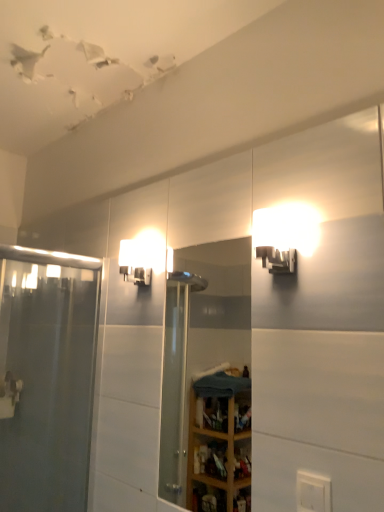
Find the location of a particular element. Image resolution: width=384 pixels, height=512 pixels. matte white sconce at upper center, which is the 1th light fixture from back to front is located at coordinates [134, 263].

Identify the location of matte white sconce at upper right, the 1th light fixture from the front. Image resolution: width=384 pixels, height=512 pixels. (284, 236).

Is point (131, 259) farther from camera compared to point (14, 432)?

That is True.

Is the surface of matte white sconce at upper center, which is the 2th light fixture in right-to-left order, in direct contact with clear glass shower door at left?

There is a gap between matte white sconce at upper center, which is the 2th light fixture in right-to-left order, and clear glass shower door at left.

Which object is closer to the camera, matte white sconce at upper center, which is the 2th light fixture in right-to-left order, or clear glass shower door at left?

clear glass shower door at left is closer to the camera.

Is matte white sconce at upper center, which is the 2th light fixture in right-to-left order, bigger or smaller than clear glass shower door at left?

Considering their sizes, matte white sconce at upper center, which is the 2th light fixture in right-to-left order, takes up less space than clear glass shower door at left.

Which object is further away from the camera, matte white sconce at upper center, which is the 2th light fixture in right-to-left order, or matte white sconce at upper right, placed as the 2th light fixture when sorted from left to right?

matte white sconce at upper center, which is the 2th light fixture in right-to-left order.

Does matte white sconce at upper center, which ranks as the first light fixture in left-to-right order, appear on the left side of matte white sconce at upper right, marked as the 2th light fixture in a back-to-front arrangement?

Indeed, matte white sconce at upper center, which ranks as the first light fixture in left-to-right order, is positioned on the left side of matte white sconce at upper right, marked as the 2th light fixture in a back-to-front arrangement.

Which is nearer, (135, 283) or (294, 218)?

Point (135, 283) appears to be farther away from the viewer than point (294, 218).

Is matte white sconce at upper center, acting as the second light fixture starting from the front, completely or partially outside of matte white sconce at upper right, marked as the 2th light fixture in a back-to-front arrangement?

That's correct, matte white sconce at upper center, acting as the second light fixture starting from the front, is outside of matte white sconce at upper right, marked as the 2th light fixture in a back-to-front arrangement.

Is clear glass mirror at center facing towards clear glass shower door at left?

No, clear glass mirror at center is not turned towards clear glass shower door at left.

From the image's perspective, which one is positioned lower, clear glass mirror at center or clear glass shower door at left?

clear glass shower door at left is shown below in the image.

Is point (216, 317) behind point (59, 483)?

Yes, it is behind point (59, 483).

Can you confirm if matte white sconce at upper right, the 1th light fixture from the front, is taller than white plastic electric outlet at lower right?

No.

Is matte white sconce at upper right, the 1th light fixture from the front, inside or outside of white plastic electric outlet at lower right?

matte white sconce at upper right, the 1th light fixture from the front, is not inside white plastic electric outlet at lower right, it's outside.

Can you tell me how much matte white sconce at upper right, placed as the 2th light fixture when sorted from left to right, and white plastic electric outlet at lower right differ in facing direction?

0.375 degrees.

At what (x,y) coordinates should I click in order to perform the action: click on mirror on the right of matte white sconce at upper center, acting as the second light fixture starting from the front. Please return your answer as a coordinate pair (x, y). The width and height of the screenshot is (384, 512). Looking at the image, I should click on (206, 372).

From the picture: Who is smaller, matte white sconce at upper center, which is the 2th light fixture in right-to-left order, or clear glass mirror at center?

matte white sconce at upper center, which is the 2th light fixture in right-to-left order.

Looking at this image, does matte white sconce at upper center, which is the 2th light fixture in right-to-left order, have a greater height compared to clear glass mirror at center?

No.

From a real-world perspective, is matte white sconce at upper center, which ranks as the first light fixture in left-to-right order, positioned over clear glass mirror at center based on gravity?

Yes, from a real-world perspective, matte white sconce at upper center, which ranks as the first light fixture in left-to-right order, is above clear glass mirror at center.

From the picture: Who is more distant, clear glass mirror at center or white plastic electric outlet at lower right?

Positioned behind is clear glass mirror at center.

How different are the orientations of clear glass mirror at center and white plastic electric outlet at lower right in degrees?

0.668 degrees separate the facing orientations of clear glass mirror at center and white plastic electric outlet at lower right.

Could you tell me if clear glass mirror at center is turned towards white plastic electric outlet at lower right?

No, clear glass mirror at center is not oriented towards white plastic electric outlet at lower right.

From a real-world perspective, which is physically below, white plastic electric outlet at lower right or matte white sconce at upper center, which is the 1th light fixture from back to front?

From a 3D spatial view, white plastic electric outlet at lower right is below.

Is white plastic electric outlet at lower right wider than matte white sconce at upper center, which is the 2th light fixture in right-to-left order?

No.

From the image's perspective, does white plastic electric outlet at lower right appear lower than matte white sconce at upper center, acting as the second light fixture starting from the front?

Correct, white plastic electric outlet at lower right appears lower than matte white sconce at upper center, acting as the second light fixture starting from the front, in the image.

This screenshot has width=384, height=512. What are the coordinates of `screen door lying on the left of matte white sconce at upper center, which ranks as the first light fixture in left-to-right order` in the screenshot? It's located at (46, 377).

I want to click on light fixture located underneath the matte white sconce at upper right, the first light fixture in the right-to-left sequence (from a real-world perspective), so click(x=134, y=263).

Based on their spatial positions, is matte white sconce at upper center, which is the 2th light fixture in right-to-left order, or white plastic electric outlet at lower right closer to clear glass shower door at left?

Based on the image, matte white sconce at upper center, which is the 2th light fixture in right-to-left order, appears to be nearer to clear glass shower door at left.

Estimate the real-world distances between objects in this image. Which object is further from white plastic electric outlet at lower right, clear glass mirror at center or matte white sconce at upper center, which is the 1th light fixture from back to front?

clear glass mirror at center is further to white plastic electric outlet at lower right.

Considering their positions, is matte white sconce at upper right, marked as the 2th light fixture in a back-to-front arrangement, positioned further to clear glass shower door at left than matte white sconce at upper center, acting as the second light fixture starting from the front?

The object further to clear glass shower door at left is matte white sconce at upper right, marked as the 2th light fixture in a back-to-front arrangement.

Considering their positions, is matte white sconce at upper right, the 1th light fixture from the front, positioned closer to matte white sconce at upper center, which ranks as the first light fixture in left-to-right order, than white plastic electric outlet at lower right?

matte white sconce at upper right, the 1th light fixture from the front, lies closer to matte white sconce at upper center, which ranks as the first light fixture in left-to-right order, than the other object.

From the image, which object appears to be nearer to white plastic electric outlet at lower right, clear glass mirror at center or matte white sconce at upper right, placed as the 2th light fixture when sorted from left to right?

matte white sconce at upper right, placed as the 2th light fixture when sorted from left to right.

Looking at the image, which one is located further to matte white sconce at upper center, which ranks as the first light fixture in left-to-right order, white plastic electric outlet at lower right or clear glass shower door at left?

white plastic electric outlet at lower right is positioned further to the anchor matte white sconce at upper center, which ranks as the first light fixture in left-to-right order.

Based on their spatial positions, is clear glass shower door at left or matte white sconce at upper center, which is the 1th light fixture from back to front, closer to white plastic electric outlet at lower right?

The object closer to white plastic electric outlet at lower right is matte white sconce at upper center, which is the 1th light fixture from back to front.

Considering their positions, is clear glass shower door at left positioned further to matte white sconce at upper center, which ranks as the first light fixture in left-to-right order, than matte white sconce at upper right, the first light fixture in the right-to-left sequence?

clear glass shower door at left is positioned further to the anchor matte white sconce at upper center, which ranks as the first light fixture in left-to-right order.

The height and width of the screenshot is (512, 384). Identify the location of light fixture between clear glass shower door at left and clear glass mirror at center in the horizontal direction. (134, 263).

Identify the location of mirror located between clear glass shower door at left and white plastic electric outlet at lower right in the left-right direction. (206, 372).

The height and width of the screenshot is (512, 384). I want to click on light fixture between matte white sconce at upper right, marked as the 2th light fixture in a back-to-front arrangement, and white plastic electric outlet at lower right from top to bottom, so click(134, 263).

I want to click on mirror that lies between matte white sconce at upper right, placed as the 2th light fixture when sorted from left to right, and white plastic electric outlet at lower right from top to bottom, so click(x=206, y=372).